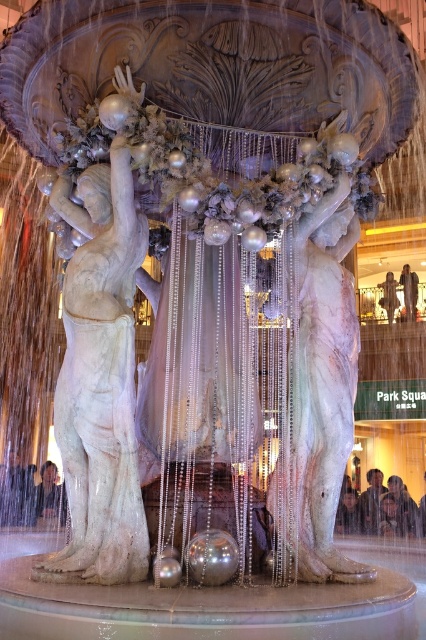
This screenshot has width=426, height=640. Describe the element at coordinates (100, 365) in the screenshot. I see `white marble statue at left` at that location.

Who is shorter, white marble statue at left or white marble statue at center?

white marble statue at center

You are a GUI agent. You are given a task and a screenshot of the screen. Output one action in this format:
    pyautogui.click(x=<x>, y=<y>)
    Task: Click on the white marble statue at left
    
    Given the screenshot: What is the action you would take?
    pyautogui.click(x=100, y=365)

Locate an element on the screen. The width and height of the screenshot is (426, 640). white marble statue at left is located at coordinates (100, 365).